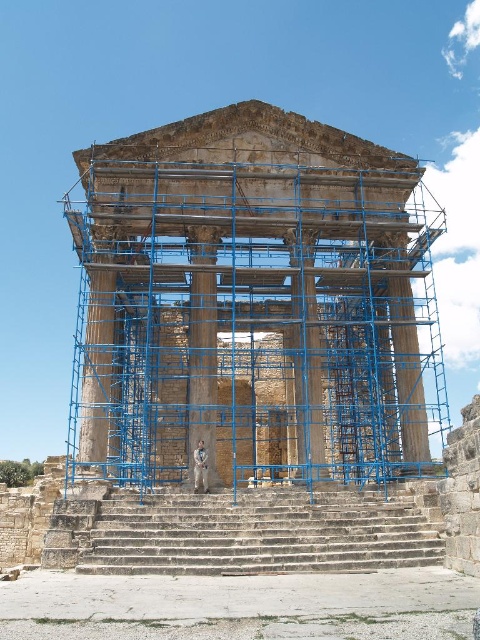
Question: Which of the following is the closest to the observer?

Choices:
 (A) (162, 140)
 (B) (228, 545)

Answer: (B)

Question: Can you confirm if stone temple at center is bigger than stone stairs at center?

Choices:
 (A) no
 (B) yes

Answer: (B)

Question: Which object is closer to the camera taking this photo?

Choices:
 (A) smooth stone pillar at center
 (B) stone stairs at center

Answer: (B)

Question: Is stone temple at center bigger than stone stairs at center?

Choices:
 (A) yes
 (B) no

Answer: (A)

Question: Which point appears closest to the camera in this image?

Choices:
 (A) [x=191, y=360]
 (B) [x=69, y=200]
 (C) [x=134, y=554]

Answer: (C)

Question: Is stone temple at center positioned behind stone stairs at center?

Choices:
 (A) yes
 (B) no

Answer: (A)